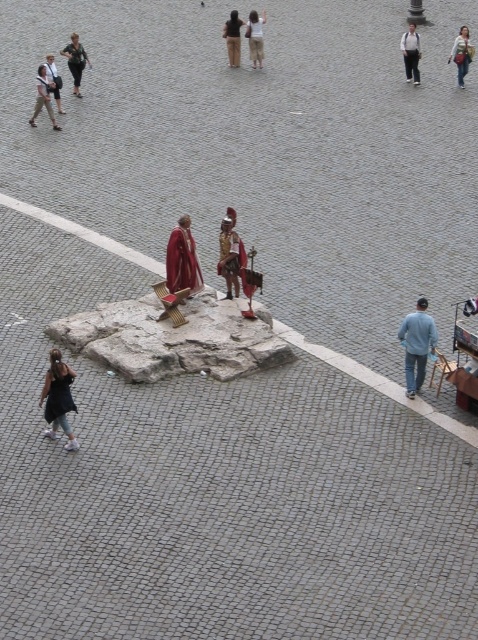
Question: Which point is closer to the camera?

Choices:
 (A) (39, 93)
 (B) (73, 60)

Answer: (A)

Question: Can you confirm if light blue jeans at upper right is positioned above khaki pants at left?

Choices:
 (A) yes
 (B) no

Answer: (A)

Question: Among these points, which one is farthest from the camera?

Choices:
 (A) (249, 36)
 (B) (228, 228)
 (C) (54, 65)
 (D) (42, 77)

Answer: (A)

Question: Which of the following is the farthest from the observer?

Choices:
 (A) gold textured armor at center
 (B) white cotton shirt at upper center

Answer: (B)

Question: Is khaki pants at left positioned in front of matte black backpack at upper left?

Choices:
 (A) yes
 (B) no

Answer: (A)

Question: In this image, where is blue denim jeans at lower right located relative to dark gray fabric dress at upper left?

Choices:
 (A) above
 (B) below

Answer: (B)